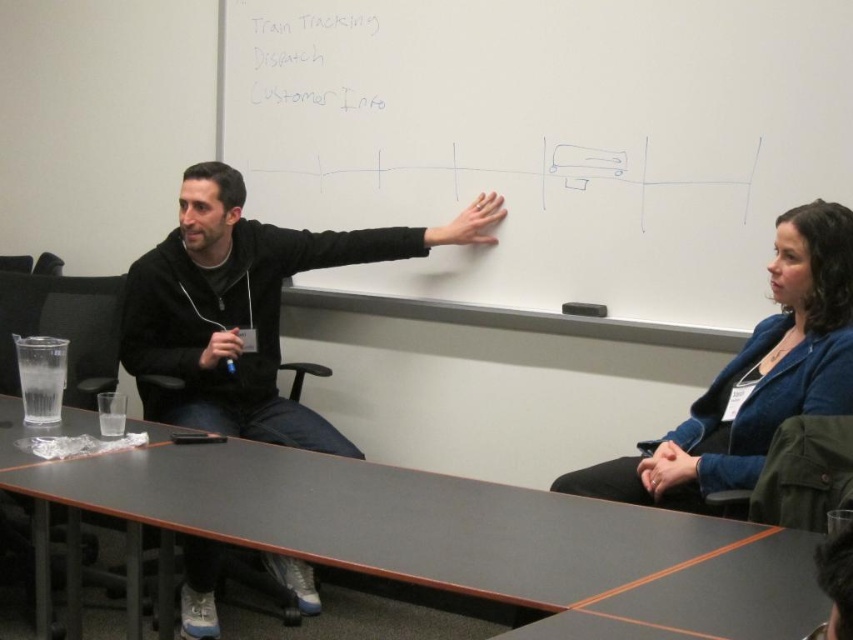
You are a presenter standing at the front of the room. You need to reach both the white matte board at center and the smooth black table at center. Which object is closer to you?

The white matte board at center is closer to you because the smooth black table at center is behind it.

You are organizing a presentation and need to place a large poster on the table. Based on the scene, can the smooth black table at center accommodate the poster if the poster is wider than the black matte hoodie at upper left?

The smooth black table at center is wider than the black matte hoodie at upper left. Since the poster is wider than the hoodie, it should fit on the table.